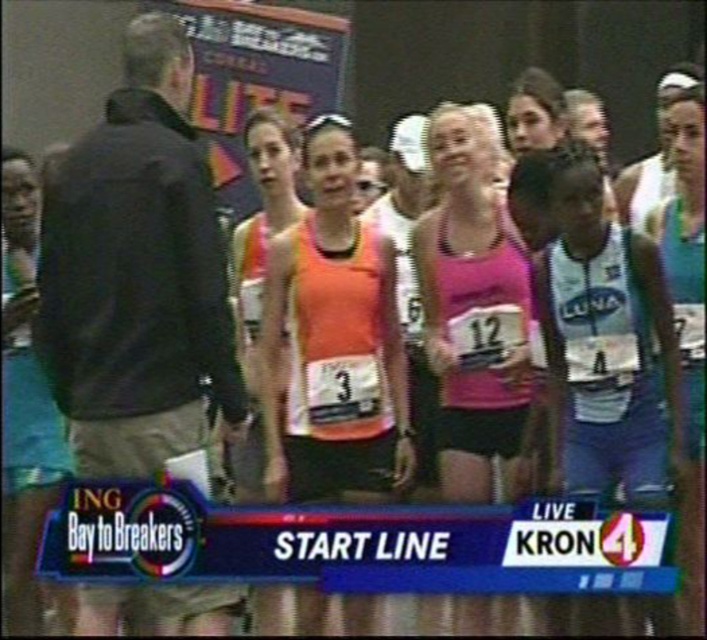
Does blue plastic banner at lower center have a lesser width compared to teal fabric shorts at center?

Incorrect, blue plastic banner at lower center's width is not less than teal fabric shorts at center's.

Identify the location of blue plastic banner at lower center. (354, 544).

Is blue plastic banner at lower center to the left of orange fabric tank top at center from the viewer's perspective?

Incorrect, blue plastic banner at lower center is not on the left side of orange fabric tank top at center.

Between point (264, 536) and point (395, 436), which one is positioned in front?

Positioned in front is point (264, 536).

Identify the location of blue plastic banner at lower center. click(354, 544).

Does pink fabric tank top at center come behind teal fabric shorts at center?

Yes.

Which is in front, point (452, 150) or point (25, 524)?

Positioned in front is point (25, 524).

This screenshot has height=640, width=707. Find the location of `pink fabric tank top at center`. pink fabric tank top at center is located at coordinates (473, 305).